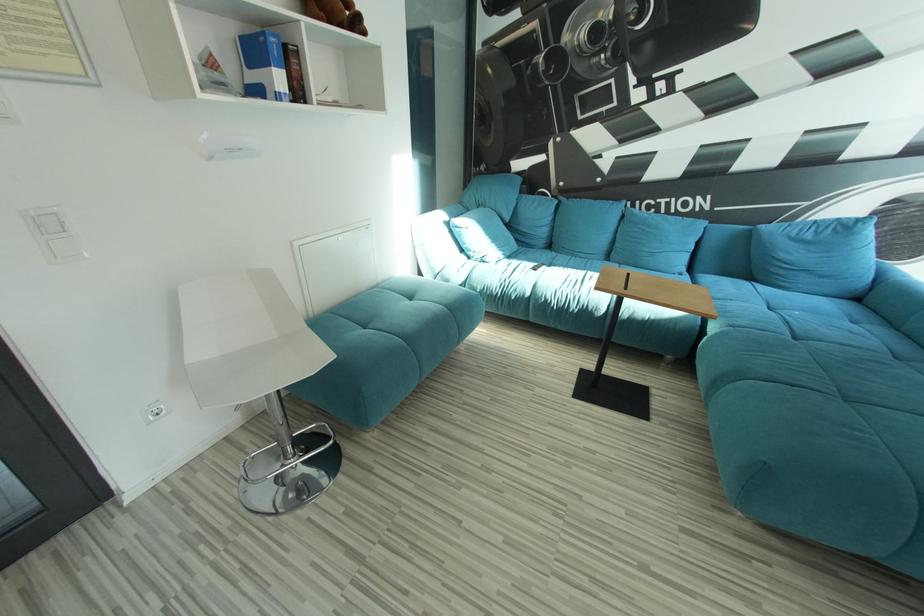
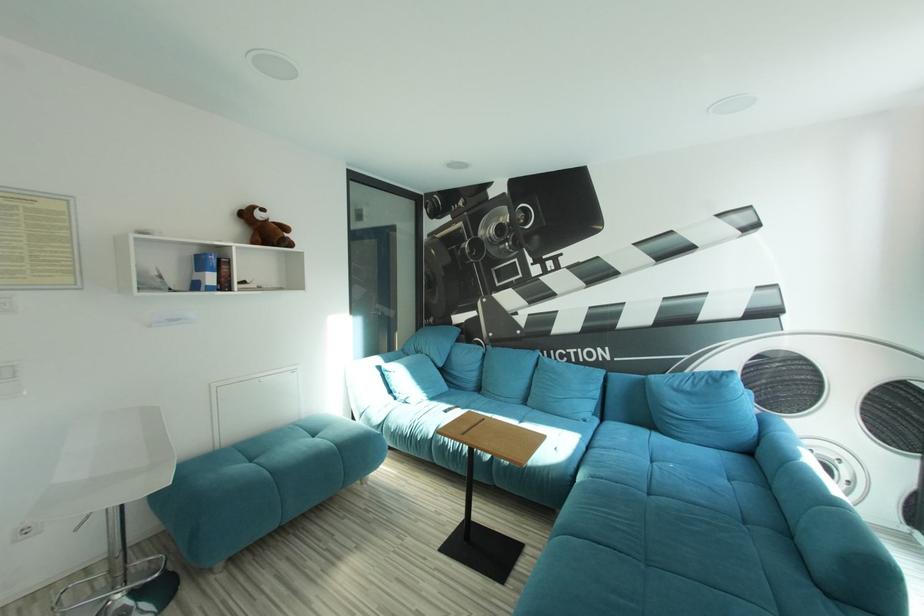
Question: The images are taken continuously from a first-person perspective. In which direction are you moving?

Choices:
 (A) Left
 (B) Right
 (C) Forward
 (D) Backward

Answer: (B)